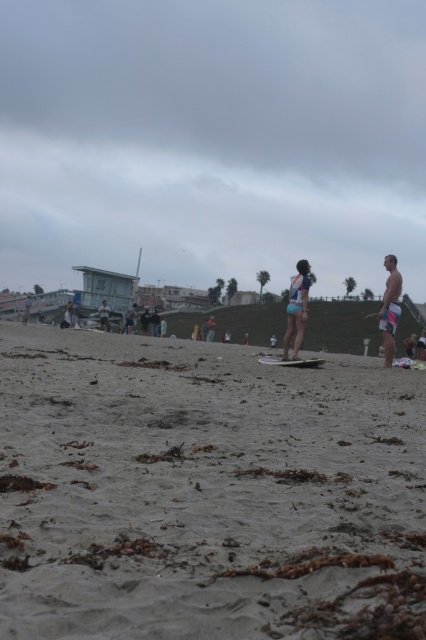
Which is more to the left, white surfboard at right or light blue denim shorts at center?

Positioned to the left is light blue denim shorts at center.

Does white surfboard at right lie in front of light blue denim shorts at center?

Yes, it is.

Which is behind, point (379, 326) or point (25, 307)?

The point (25, 307) is more distant.

Find the location of a particular element. The height and width of the screenshot is (640, 426). white surfboard at right is located at coordinates (389, 307).

Between point (172, 396) and point (100, 316), which one is positioned behind?

Positioned behind is point (100, 316).

Can you confirm if gray sandy beach at center is positioned above smooth tan surfboard at center?

No.

Who is more distant from viewer, (184, 529) or (108, 317)?

The point (108, 317) is more distant.

Where is `gray sandy beach at center`? The width and height of the screenshot is (426, 640). gray sandy beach at center is located at coordinates (206, 492).

You are a GUI agent. You are given a task and a screenshot of the screen. Output one action in this format:
    pyautogui.click(x=<x>, y=<y>)
    Task: Click on the gray sandy beach at center
    This screenshot has height=640, width=426.
    Given the screenshot: What is the action you would take?
    pyautogui.click(x=206, y=492)

Does gray sandy beach at center appear under white surfboard at right?

Yes.

What do you see at coordinates (206, 492) in the screenshot?
I see `gray sandy beach at center` at bounding box center [206, 492].

The width and height of the screenshot is (426, 640). I want to click on gray sandy beach at center, so click(x=206, y=492).